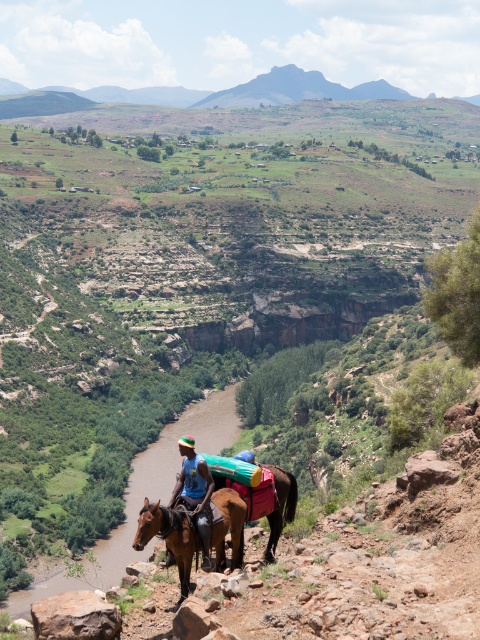
You are a hiker planning to cross the rocky path in the foreground. You notice a brown leather donkey at center and a blue fabric shirt at center. Which object is narrower, and would it be easier to navigate around it?

The brown leather donkey at center is narrower than the blue fabric shirt at center. Since it is narrower, it would be easier to navigate around the brown leather donkey at center.